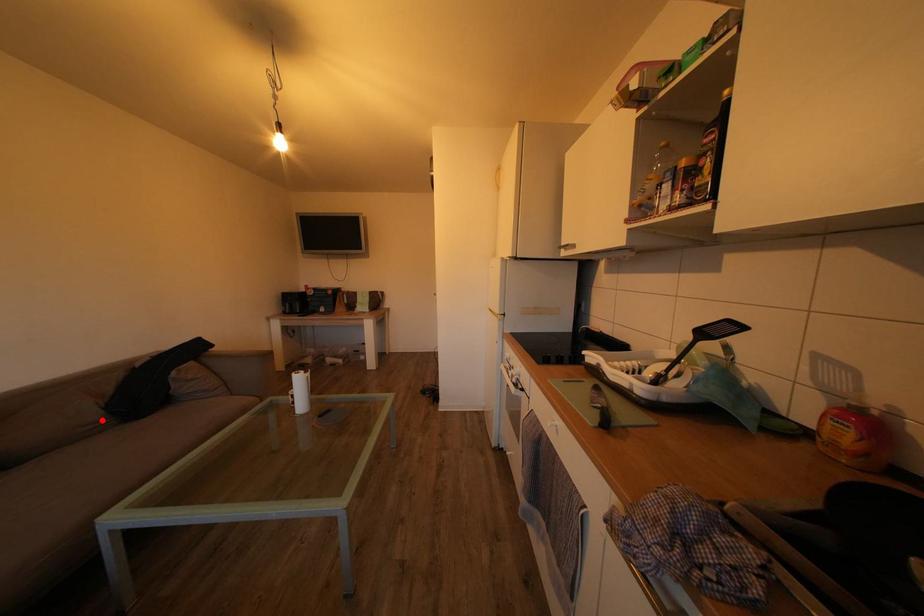
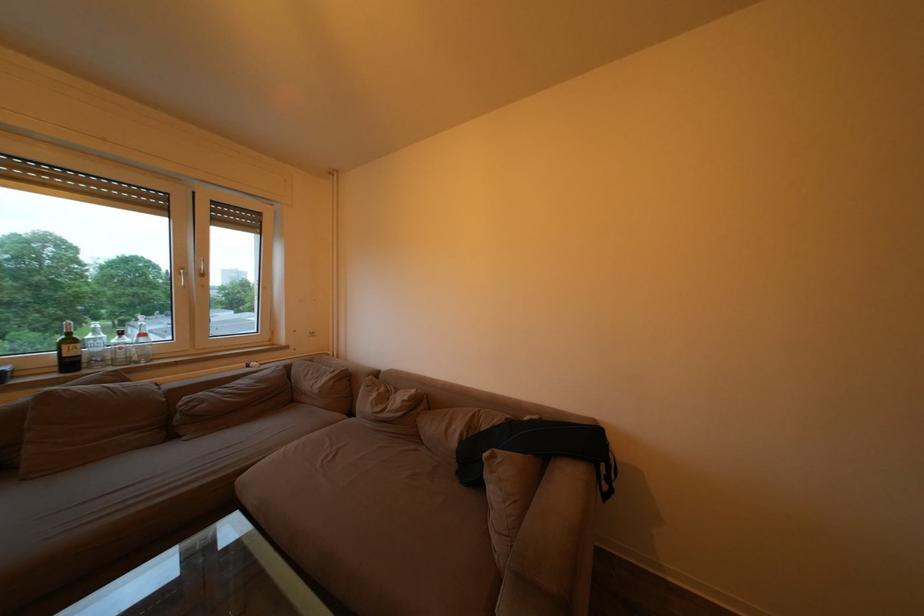
Where in the second image is the point corresponding to the highlighted location from the first image?

(463, 448)